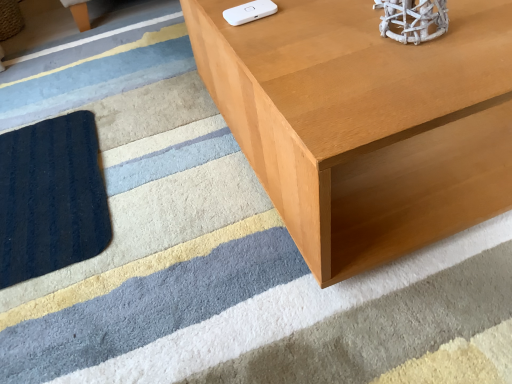
Question: From a real-world perspective, relative to light brown wood table at upper right, is white matte wii controller at upper center vertically above or below?

Choices:
 (A) above
 (B) below

Answer: (A)

Question: In terms of width, does white matte wii controller at upper center look wider or thinner when compared to light brown wood table at upper right?

Choices:
 (A) thin
 (B) wide

Answer: (A)

Question: From the image's perspective, is white matte wii controller at upper center above or below light brown wood table at upper right?

Choices:
 (A) below
 (B) above

Answer: (A)

Question: Looking at the image, does light brown wood table at upper right seem bigger or smaller compared to white matte wii controller at upper center?

Choices:
 (A) small
 (B) big

Answer: (B)

Question: Is light brown wood table at upper right taller or shorter than white matte wii controller at upper center?

Choices:
 (A) tall
 (B) short

Answer: (A)

Question: Is point (462, 14) positioned closer to the camera than point (260, 3)?

Choices:
 (A) farther
 (B) closer

Answer: (B)

Question: Looking at their shapes, would you say light brown wood table at upper right is wider or thinner than white matte wii controller at upper center?

Choices:
 (A) thin
 (B) wide

Answer: (B)